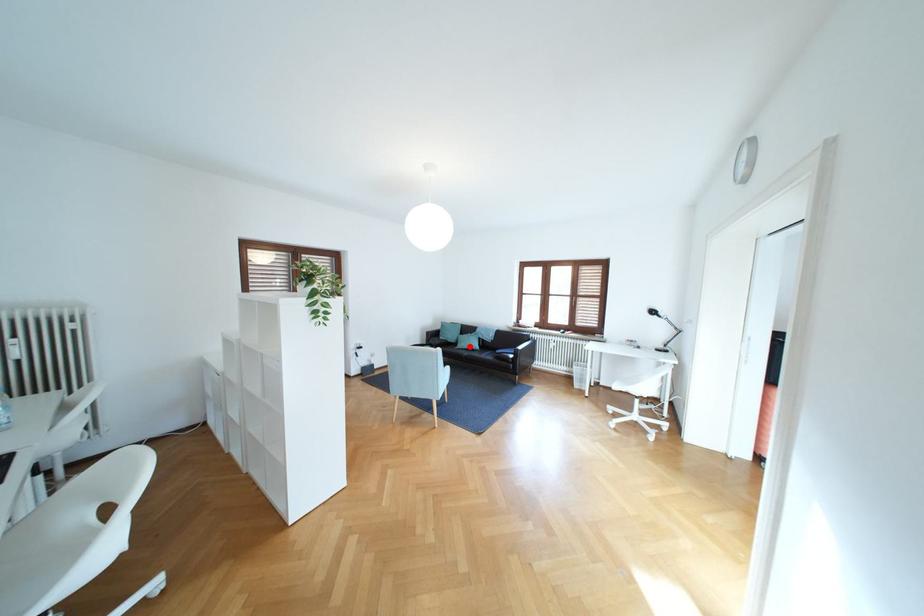
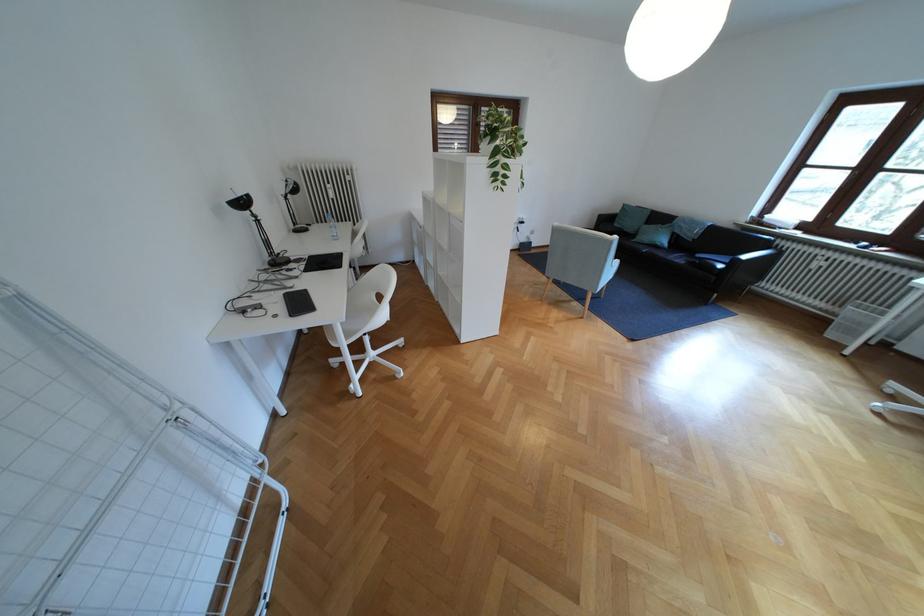
The point at the highlighted location is marked in the first image. Where is the corresponding point in the second image?

(649, 238)